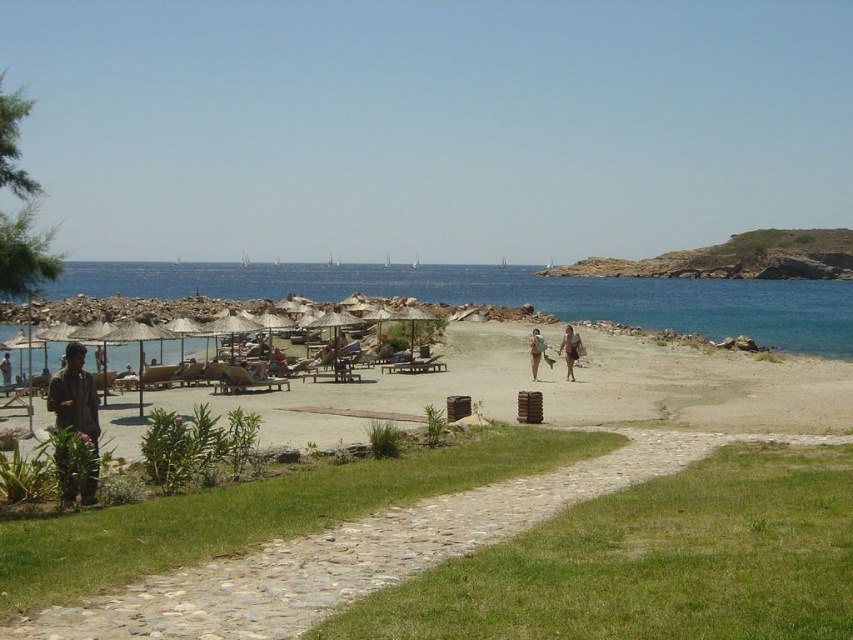
Between beige sand beach at lower left and green grass at lower center, which one appears on the right side from the viewer's perspective?

From the viewer's perspective, green grass at lower center appears more on the right side.

Based on the photo, does beige sand beach at lower left have a smaller size compared to green grass at lower center?

No.

Identify the location of beige sand beach at lower left. The width and height of the screenshot is (853, 640). (561, 388).

The height and width of the screenshot is (640, 853). I want to click on beige sand beach at lower left, so click(561, 388).

Can you confirm if blue water at center is wider than green fabric shirt at lower left?

Yes, blue water at center is wider than green fabric shirt at lower left.

Is blue water at center bigger than green fabric shirt at lower left?

Indeed, blue water at center has a larger size compared to green fabric shirt at lower left.

Who is more distant from viewer, (x=169, y=262) or (x=91, y=412)?

Positioned behind is point (x=169, y=262).

I want to click on blue water at center, so click(511, 296).

Is tan skin person at center shorter than brown leather jacket at lower left?

No.

Which is more to the right, tan skin person at center or brown leather jacket at lower left?

From the viewer's perspective, tan skin person at center appears more on the right side.

What do you see at coordinates (535, 352) in the screenshot? The image size is (853, 640). I see `tan skin person at center` at bounding box center [535, 352].

At what (x,y) coordinates should I click in order to perform the action: click on tan skin person at center. Please return your answer as a coordinate pair (x, y). The height and width of the screenshot is (640, 853). Looking at the image, I should click on (535, 352).